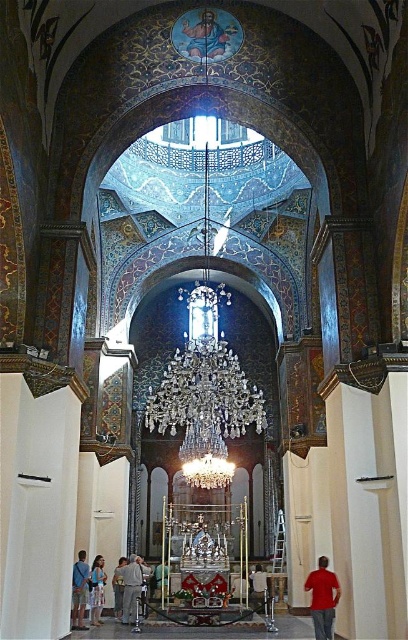
Who is lower down, gray fabric pants at lower center or light brown leather jacket at lower left?

light brown leather jacket at lower left is below.

Between gray fabric pants at lower center and light brown leather jacket at lower left, which one appears on the left side from the viewer's perspective?

Positioned to the left is light brown leather jacket at lower left.

Is point (135, 580) more distant than point (117, 566)?

That is False.

You are a GUI agent. You are given a task and a screenshot of the screen. Output one action in this format:
    pyautogui.click(x=<x>, y=<y>)
    Task: Click on the gray fabric pants at lower center
    The width and height of the screenshot is (408, 640).
    Given the screenshot: What is the action you would take?
    pyautogui.click(x=130, y=586)

Can you confirm if blue denim jeans at lower left is wider than light brown leather jacket at lower left?

Incorrect, blue denim jeans at lower left's width does not surpass light brown leather jacket at lower left's.

Who is lower down, blue denim jeans at lower left or light brown leather jacket at lower left?

light brown leather jacket at lower left is lower down.

Between point (75, 595) and point (119, 576), which one is positioned behind?

Point (119, 576)

In order to click on blue denim jeans at lower left in this screenshot , I will do `click(79, 589)`.

Is red cotton shirt at lower right behind white floral dress at lower left?

No, it is in front of white floral dress at lower left.

Based on the photo, between red cotton shirt at lower right and white floral dress at lower left, which one appears on the left side from the viewer's perspective?

white floral dress at lower left

Is point (328, 586) positioned after point (102, 605)?

No, (328, 586) is closer to viewer.

Where is `red cotton shirt at lower right`? Image resolution: width=408 pixels, height=640 pixels. red cotton shirt at lower right is located at coordinates (323, 596).